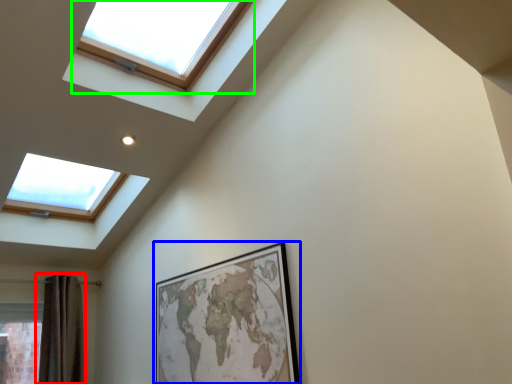
Question: Estimate the real-world distances between objects in this image. Which object is closer to shower curtain (highlighted by a red box), picture frame (highlighted by a blue box) or window (highlighted by a green box)?

Choices:
 (A) picture frame
 (B) window

Answer: (A)